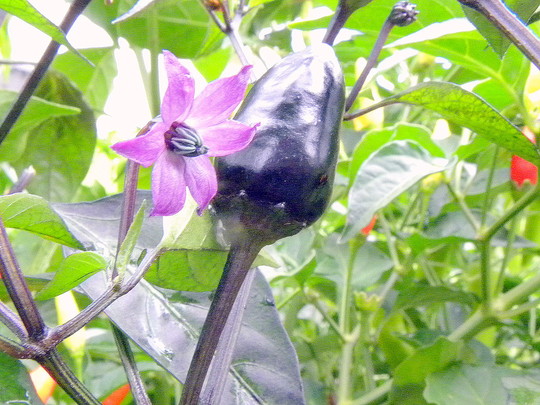
Identify the location of orange flowers. (114, 392), (37, 377).